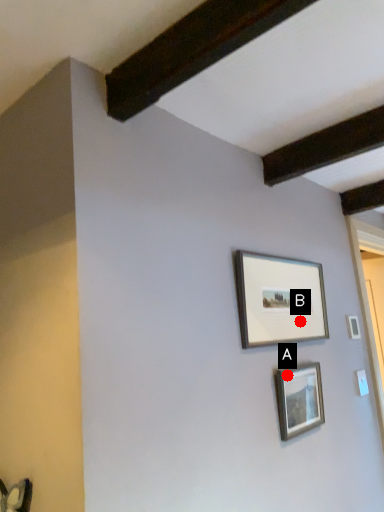
Question: Two points are circled on the image, labeled by A and B beside each circle. Which point is farther to the camera?

Choices:
 (A) A is further
 (B) B is further

Answer: (B)